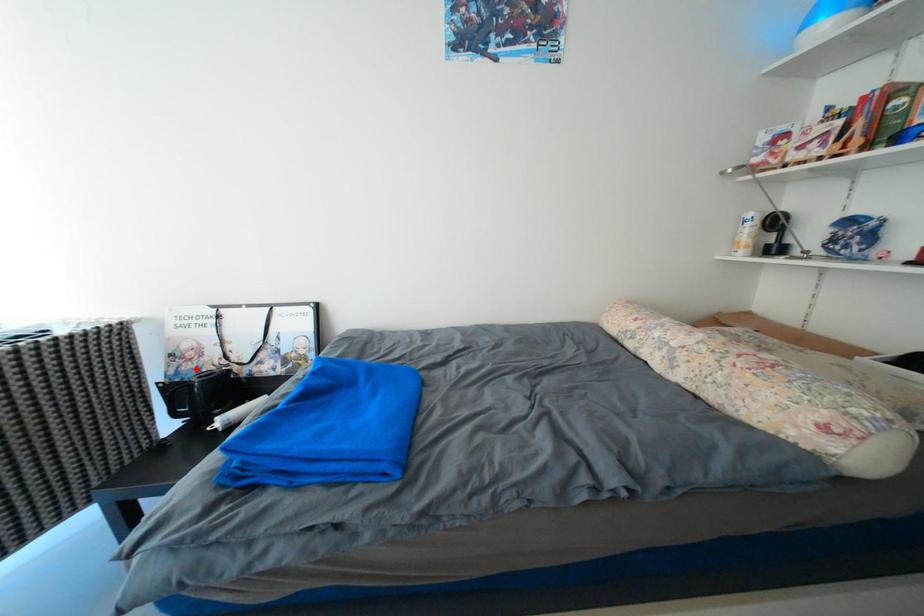
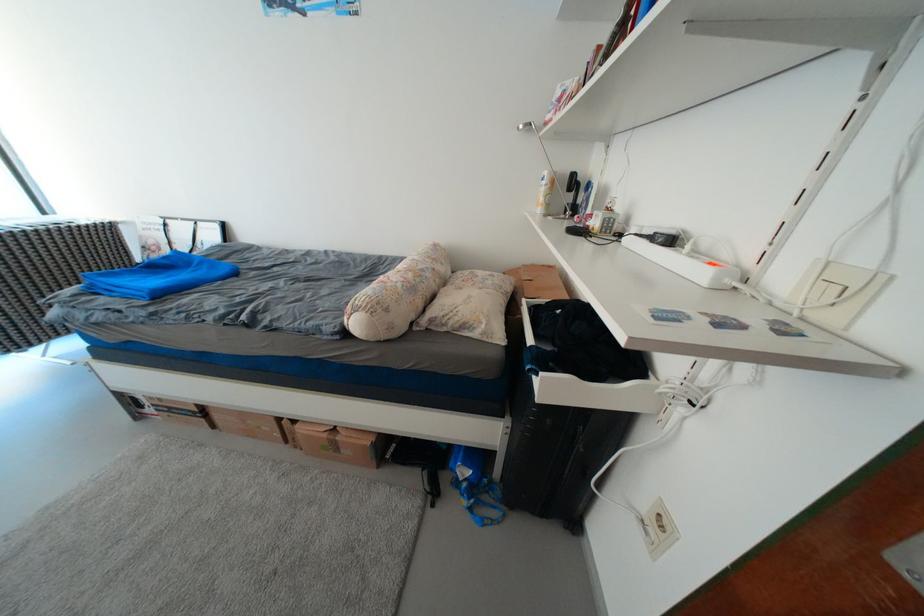
Question: I am providing you with two images of the same scene from different viewpoints. In image1, a red point is highlighted. Considering the same 3D point in image2, which of the following is correct?

Choices:
 (A) It is closer
 (B) It is farther

Answer: (B)